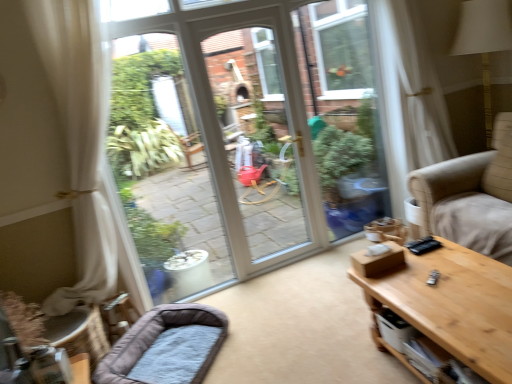
Question: Is gray plush dog bed at lower left positioned far away from wooden table at right?

Choices:
 (A) no
 (B) yes

Answer: (B)

Question: Is gray plush dog bed at lower left further to the viewer compared to wooden table at right?

Choices:
 (A) yes
 (B) no

Answer: (A)

Question: Can you confirm if gray plush dog bed at lower left is bigger than wooden table at right?

Choices:
 (A) no
 (B) yes

Answer: (A)

Question: Can you confirm if gray plush dog bed at lower left is thinner than wooden table at right?

Choices:
 (A) no
 (B) yes

Answer: (B)

Question: From a real-world perspective, is gray plush dog bed at lower left positioned under wooden table at right based on gravity?

Choices:
 (A) yes
 (B) no

Answer: (A)

Question: Is gray plush dog bed at lower left oriented towards wooden table at right?

Choices:
 (A) no
 (B) yes

Answer: (B)

Question: Could gray plush dog bed at lower left be considered to be inside wooden table at right?

Choices:
 (A) no
 (B) yes

Answer: (A)

Question: Considering the relative sizes of wooden table at right and gray plush dog bed at lower left in the image provided, is wooden table at right thinner than gray plush dog bed at lower left?

Choices:
 (A) yes
 (B) no

Answer: (B)

Question: Does wooden table at right turn towards gray plush dog bed at lower left?

Choices:
 (A) yes
 (B) no

Answer: (A)

Question: Is wooden table at right closer to camera compared to gray plush dog bed at lower left?

Choices:
 (A) yes
 (B) no

Answer: (A)

Question: From the image's perspective, would you say wooden table at right is positioned over gray plush dog bed at lower left?

Choices:
 (A) no
 (B) yes

Answer: (B)

Question: From a real-world perspective, is wooden table at right located higher than gray plush dog bed at lower left?

Choices:
 (A) yes
 (B) no

Answer: (A)

Question: Would you say wooden table at right is to the left or to the right of gray plush dog bed at lower left in the picture?

Choices:
 (A) right
 (B) left

Answer: (A)